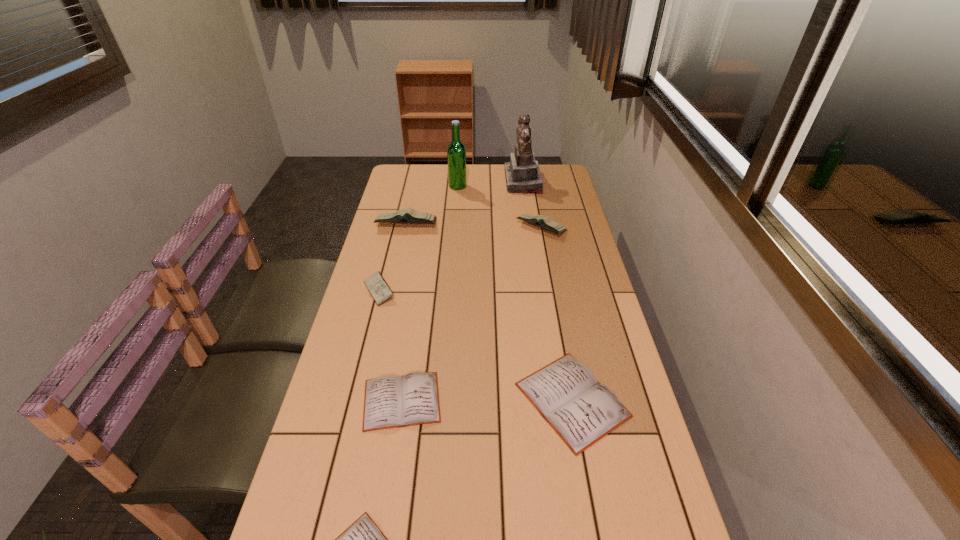
You are a GUI agent. You are given a task and a screenshot of the screen. Output one action in this format:
    pyautogui.click(x=<x>, y=<y>)
    Task: Click on the free spot between the figurine and the rightmost pink diary
    The width and height of the screenshot is (960, 540).
    Given the screenshot: What is the action you would take?
    click(532, 205)

Find the location of a particular element. The width and height of the screenshot is (960, 540). free area in between the third tallest object and the seventh tallest object is located at coordinates (404, 312).

This screenshot has height=540, width=960. I want to click on vacant space that is in between the third shortest diary and the figurine, so click(x=547, y=291).

The height and width of the screenshot is (540, 960). Find the location of `free area in between the biggest white diary and the biggest pink diary`. free area in between the biggest white diary and the biggest pink diary is located at coordinates (x=490, y=312).

I want to click on empty space that is in between the fourth tallest object and the sixth tallest object, so click(x=557, y=314).

I want to click on free space between the beer bottle and the nearest pink diary, so pos(419,239).

Where is `free area in between the green beer bottle and the sixth tallest object`? free area in between the green beer bottle and the sixth tallest object is located at coordinates (515, 293).

Select which object appears as the closest to the nearest white diary. Please provide its 2D coordinates. Your answer should be formatted as a tuple, i.e. [(x, y)], where the tuple contains the x and y coordinates of a point satisfying the conditions above.

[(390, 401)]

This screenshot has height=540, width=960. In order to click on object that is the fourth closest to the rightmost white diary in this screenshot , I will do `click(548, 223)`.

Identify which diary is the second closest to the tallest diary. Please provide its 2D coordinates. Your answer should be formatted as a tuple, i.e. [(x, y)], where the tuple contains the x and y coordinates of a point satisfying the conditions above.

[(548, 223)]